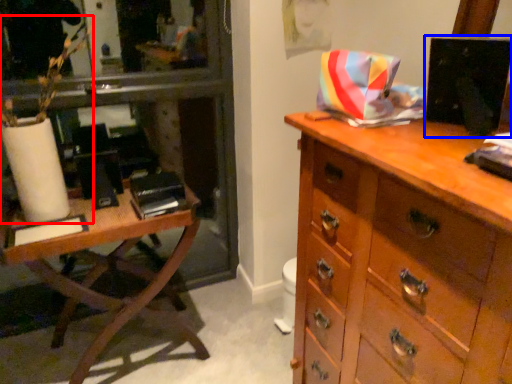
Question: Which object appears closest to the camera in this image, plant (highlighted by a red box) or computer monitor (highlighted by a blue box)?

Choices:
 (A) plant
 (B) computer monitor

Answer: (B)